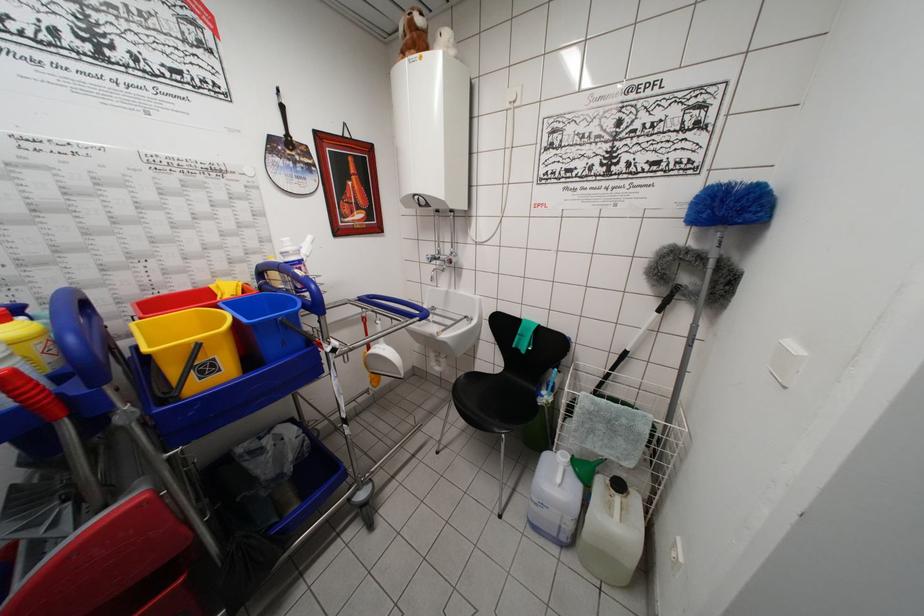
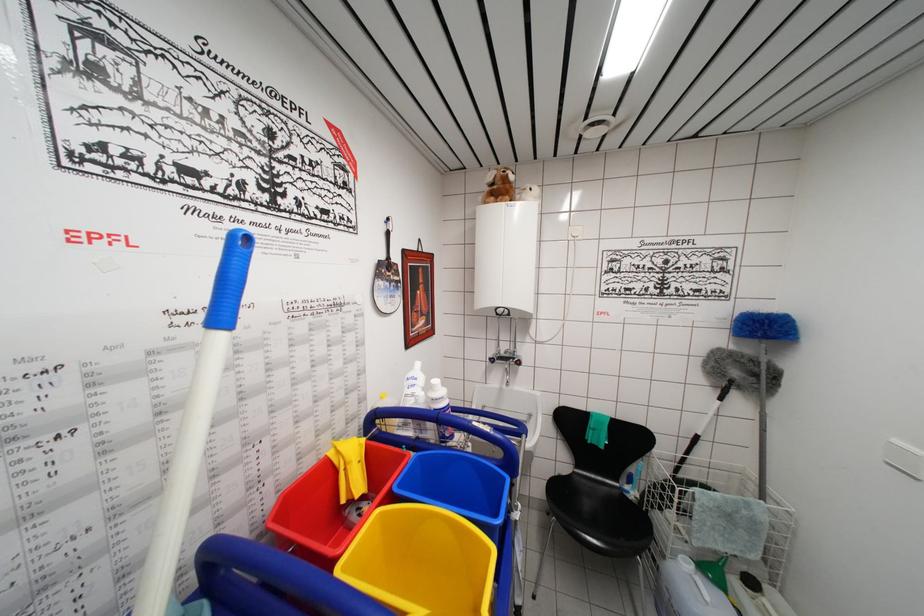
Question: The camera is either moving clockwise (left) or counter-clockwise (right) around the object. The first image is from the beginning of the video and the second image is from the end. Is the camera moving left or right when shooting the video?

Choices:
 (A) Left
 (B) Right

Answer: (A)